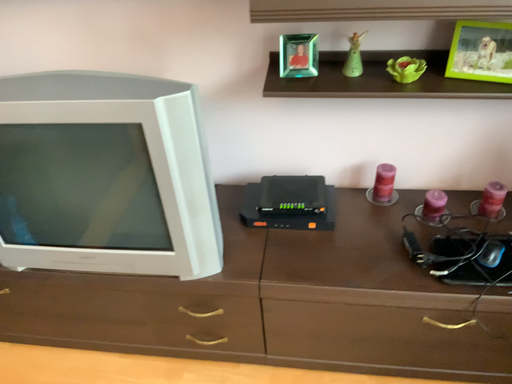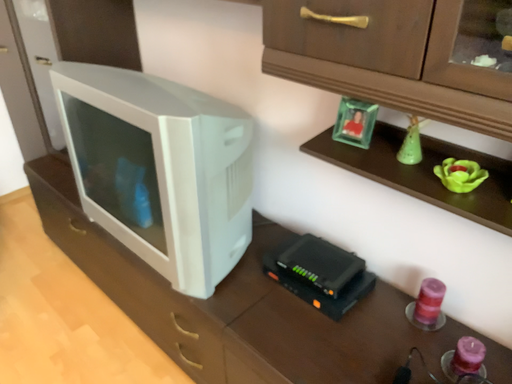
Question: How did the camera likely rotate when shooting the video?

Choices:
 (A) rotated left
 (B) rotated right

Answer: (A)